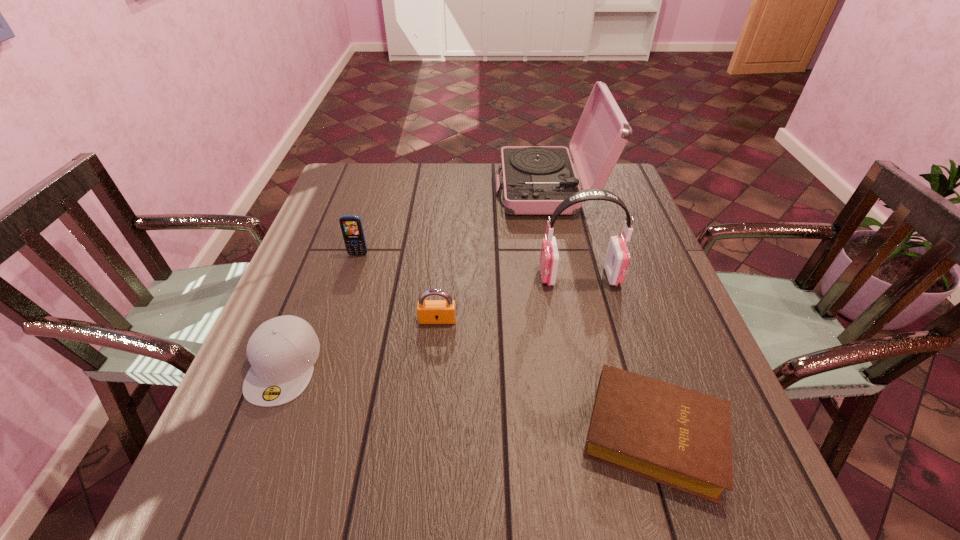
Locate an element on the screen. vacant region that satisfies the following two spatial constraints: 1. on the front-facing side of the shortest object; 2. on the right side of the cap is located at coordinates (256, 435).

Identify the location of free space that satisfies the following two spatial constraints: 1. on the front-facing side of the cap; 2. on the right side of the Bible. (x=256, y=435).

Find the location of a particular element. blank area in the image that satisfies the following two spatial constraints: 1. to unlock the Bible from the front; 2. on the left side of the fourth object from right to left is located at coordinates (426, 435).

At what (x,y) coordinates should I click in order to perform the action: click on blank space that satisfies the following two spatial constraints: 1. on the screen of the third tallest object; 2. on the right side of the Bible. Please return your answer as a coordinate pair (x, y). The height and width of the screenshot is (540, 960). Looking at the image, I should click on (301, 435).

This screenshot has width=960, height=540. Identify the location of free location that satisfies the following two spatial constraints: 1. with the lid open on the farthest object; 2. to unlock the fourth farthest object from the front. (576, 320).

Where is `blank space that satisfies the following two spatial constraints: 1. to unlock the padlock from the front; 2. on the right side of the shortest object`? This screenshot has width=960, height=540. blank space that satisfies the following two spatial constraints: 1. to unlock the padlock from the front; 2. on the right side of the shortest object is located at coordinates (426, 435).

This screenshot has width=960, height=540. In order to click on free space that satisfies the following two spatial constraints: 1. on the outer surface of the fifth shortest object; 2. on the front-facing side of the cap in this screenshot , I will do `click(601, 365)`.

In order to click on vacant space that satisfies the following two spatial constraints: 1. with the lid open on the farthest object; 2. to unlock the fourth object from right to left from the front in this screenshot , I will do `click(576, 320)`.